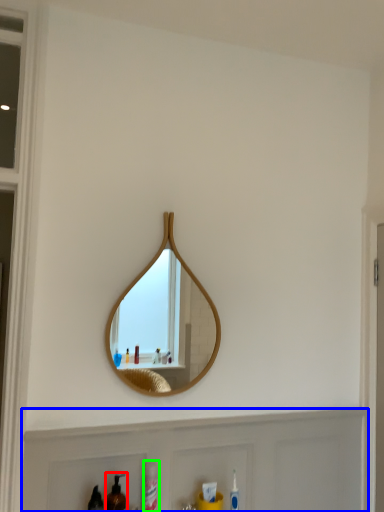
Question: Considering the real-world distances, which object is farthest from mouthwash (highlighted by a red box)? cabinet (highlighted by a blue box) or cleaning product (highlighted by a green box)?

Choices:
 (A) cabinet
 (B) cleaning product

Answer: (A)